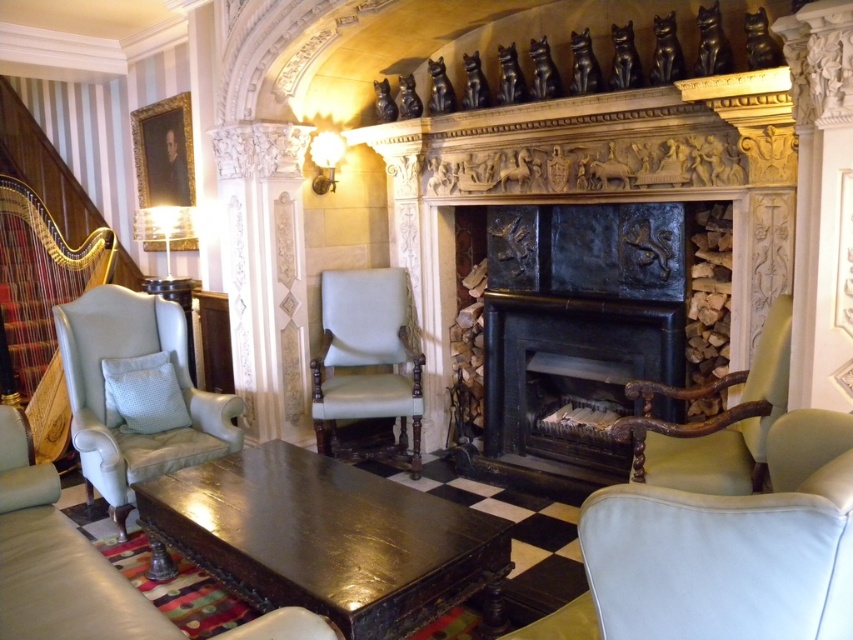
You are a guest in the room and want to sit down. The leather couch at center and the light blue leather armchair at left are both available. Which one is shorter in height?

The leather couch at center is not as tall as the light blue leather armchair at left, so the leather couch at center is shorter in height.

You are sitting on the leather couch at center and want to place a book on the light blue leather armchair at left. Can you reach it without moving from your current position?

The leather couch at center is positioned under the light blue leather armchair at left, meaning the armchair is above the couch. Since you are on the couch below, you cannot physically reach the armchair above you without moving.